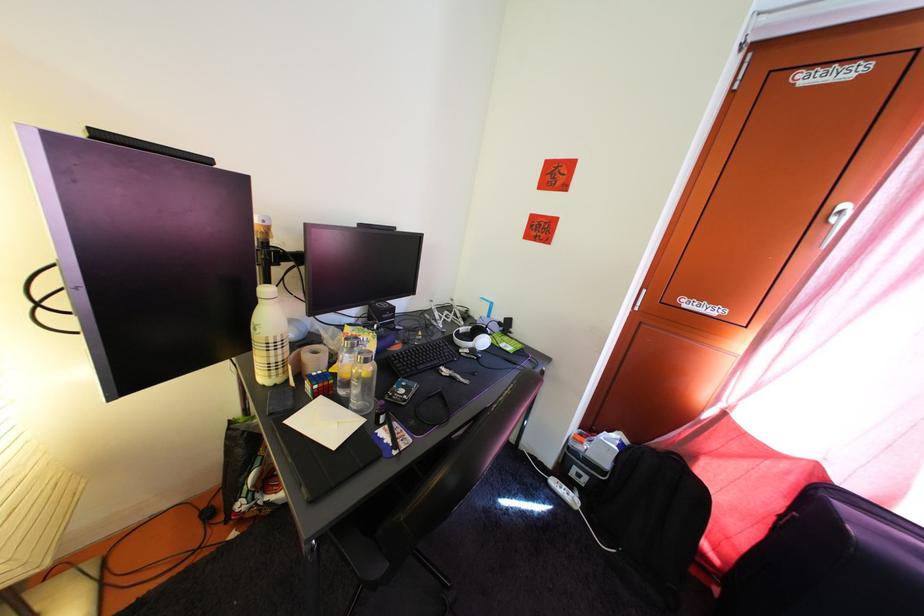
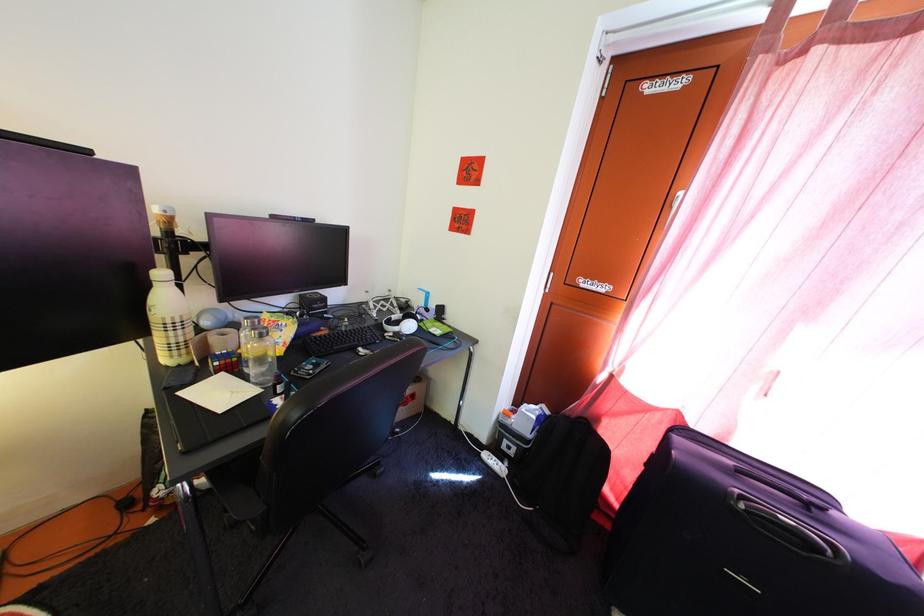
Locate, in the second image, the point that corresponds to (x=454, y=330) in the first image.

(388, 318)